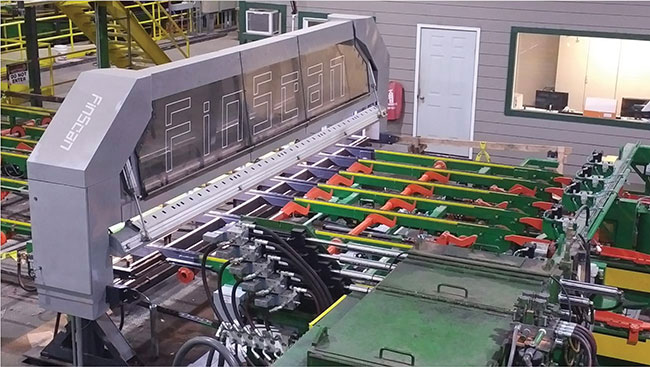
The width and height of the screenshot is (650, 367). Identify the location of door handle. (422, 97).